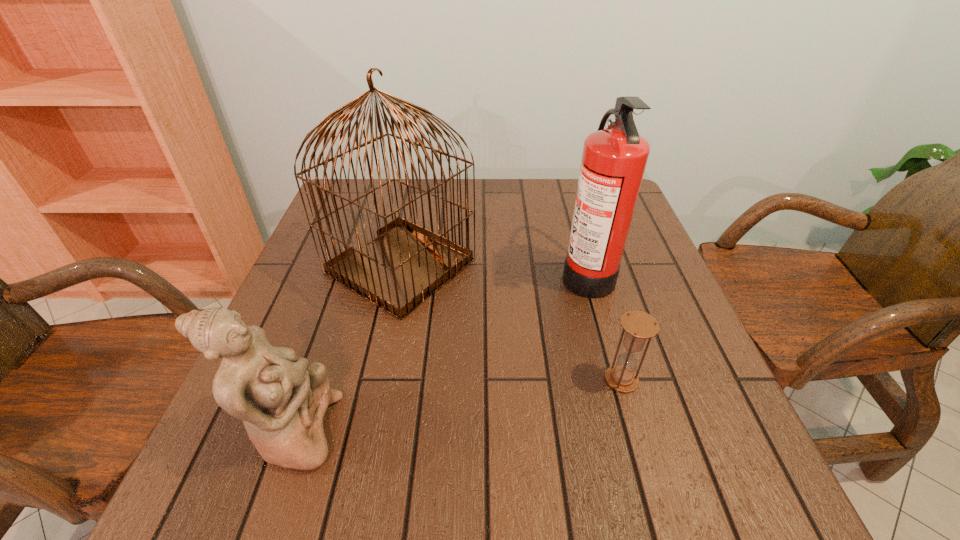
Locate an element on the screen. The height and width of the screenshot is (540, 960). free region at the far left corner of the desktop is located at coordinates (354, 194).

This screenshot has width=960, height=540. In the image, there is a desktop. What are the coordinates of `vacant space at the near right corner` in the screenshot? It's located at (740, 511).

At what (x,y) coordinates should I click in order to perform the action: click on vacant area that lies between the second shortest object and the hourglass. Please return your answer as a coordinate pair (x, y). Image resolution: width=960 pixels, height=540 pixels. Looking at the image, I should click on (457, 406).

Identify the location of empty location between the figurine and the fire extinguisher. (440, 352).

The height and width of the screenshot is (540, 960). Identify the location of vacant point located between the fire extinguisher and the birdcage. tap(493, 270).

Where is `free space between the fire extinguisher and the third tallest object`? Image resolution: width=960 pixels, height=540 pixels. free space between the fire extinguisher and the third tallest object is located at coordinates coord(440,352).

Identify the location of free space between the fire extinguisher and the birdcage. (493, 270).

This screenshot has height=540, width=960. I want to click on vacant area that lies between the shortest object and the birdcage, so click(511, 323).

What are the coordinates of `free area in between the birdcage and the fire extinguisher` in the screenshot? It's located at (493, 270).

Find the location of `free space between the birdcage and the fire extinguisher`. free space between the birdcage and the fire extinguisher is located at coordinates (493, 270).